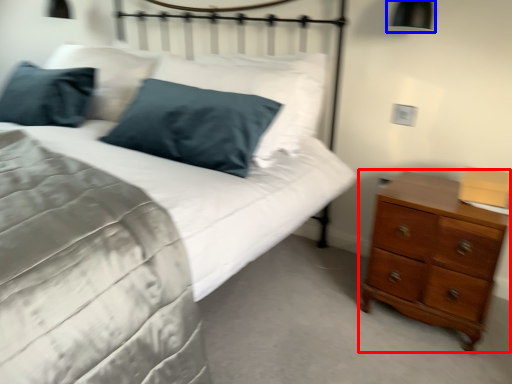
Question: Among these objects, which one is nearest to the camera, chest of drawers (highlighted by a red box) or bedside lamp (highlighted by a blue box)?

Choices:
 (A) chest of drawers
 (B) bedside lamp

Answer: (A)